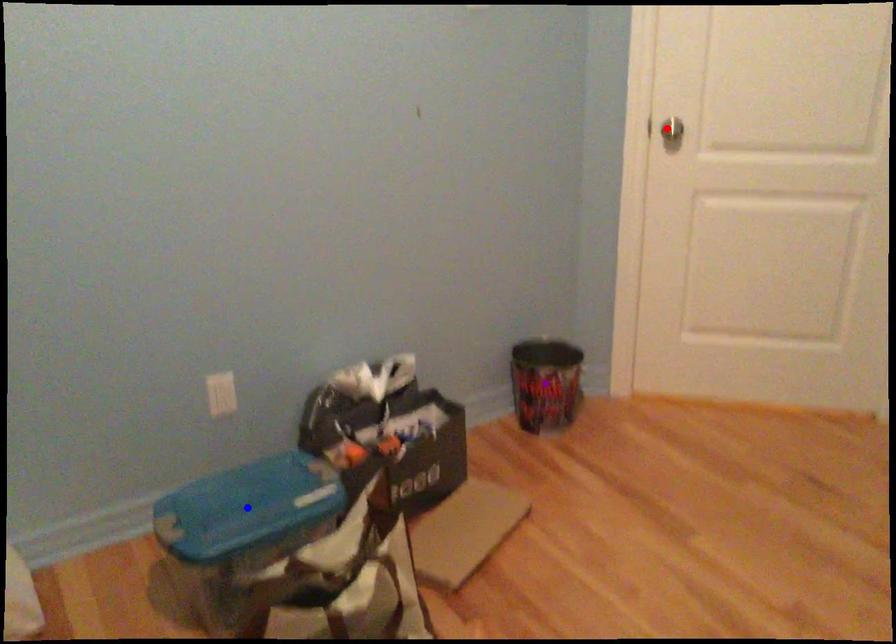
Order these from nearest to farthest:
blue point
purple point
red point

blue point, red point, purple point